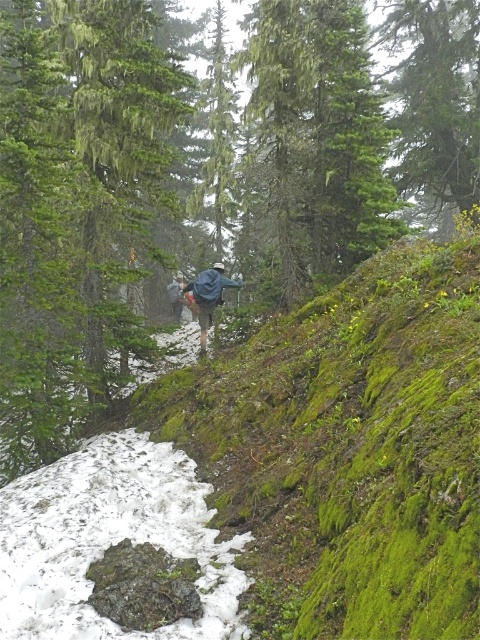
Who is higher up, blue fabric backpack at center or blue denim jacket at center?

Positioned higher is blue denim jacket at center.

Is blue fabric backpack at center wider than blue denim jacket at center?

Yes.

Which is in front, point (205, 300) or point (181, 291)?

Positioned in front is point (205, 300).

This screenshot has height=640, width=480. I want to click on blue fabric backpack at center, so click(210, 296).

Is white powdery snow at lower left below blue fabric backpack at center?

Indeed, white powdery snow at lower left is positioned under blue fabric backpack at center.

This screenshot has height=640, width=480. I want to click on white powdery snow at lower left, so click(x=108, y=540).

Does white powdery snow at lower left have a smaller size compared to blue denim jacket at center?

No.

Between white powdery snow at lower left and blue denim jacket at center, which one is positioned lower?

white powdery snow at lower left

What do you see at coordinates (108, 540) in the screenshot? I see `white powdery snow at lower left` at bounding box center [108, 540].

Image resolution: width=480 pixels, height=640 pixels. Identify the location of white powdery snow at lower left. (108, 540).